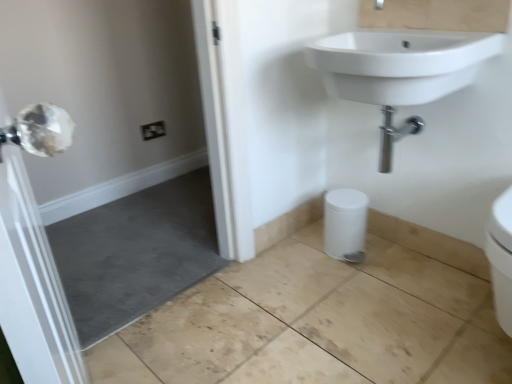
Question: Is white matte bidet at lower center wider than white ceramic sink at upper right?

Choices:
 (A) no
 (B) yes

Answer: (A)

Question: Considering the relative sizes of white matte bidet at lower center and white ceramic sink at upper right in the image provided, is white matte bidet at lower center smaller than white ceramic sink at upper right?

Choices:
 (A) yes
 (B) no

Answer: (A)

Question: Does white matte bidet at lower center appear on the left side of white ceramic sink at upper right?

Choices:
 (A) yes
 (B) no

Answer: (A)

Question: Can you see white matte bidet at lower center touching white ceramic sink at upper right?

Choices:
 (A) no
 (B) yes

Answer: (A)

Question: Is white matte bidet at lower center facing towards white ceramic sink at upper right?

Choices:
 (A) no
 (B) yes

Answer: (A)

Question: Is clear glass door at left bigger or smaller than white matte bidet at lower center?

Choices:
 (A) small
 (B) big

Answer: (B)

Question: Is clear glass door at left to the left or to the right of white matte bidet at lower center in the image?

Choices:
 (A) right
 (B) left

Answer: (B)

Question: Considering the positions of clear glass door at left and white matte bidet at lower center in the image, is clear glass door at left taller or shorter than white matte bidet at lower center?

Choices:
 (A) short
 (B) tall

Answer: (B)

Question: From a real-world perspective, is clear glass door at left positioned above or below white matte bidet at lower center?

Choices:
 (A) below
 (B) above

Answer: (B)

Question: From a real-world perspective, is clear glass door at left above or below white ceramic sink at upper right?

Choices:
 (A) above
 (B) below

Answer: (B)

Question: From their relative heights in the image, would you say clear glass door at left is taller or shorter than white ceramic sink at upper right?

Choices:
 (A) short
 (B) tall

Answer: (B)

Question: Do you think clear glass door at left is within white ceramic sink at upper right, or outside of it?

Choices:
 (A) inside
 (B) outside

Answer: (B)

Question: Is clear glass door at left in front of or behind white ceramic sink at upper right in the image?

Choices:
 (A) behind
 (B) front

Answer: (B)

Question: Is white ceramic sink at upper right wider or thinner than white matte bidet at lower center?

Choices:
 (A) wide
 (B) thin

Answer: (A)

Question: From their relative heights in the image, would you say white ceramic sink at upper right is taller or shorter than white matte bidet at lower center?

Choices:
 (A) short
 (B) tall

Answer: (B)